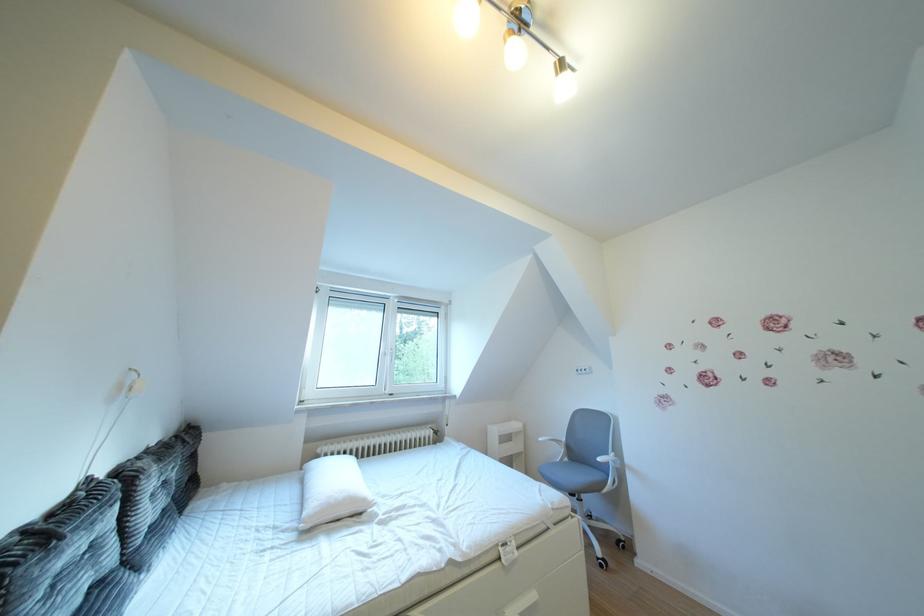
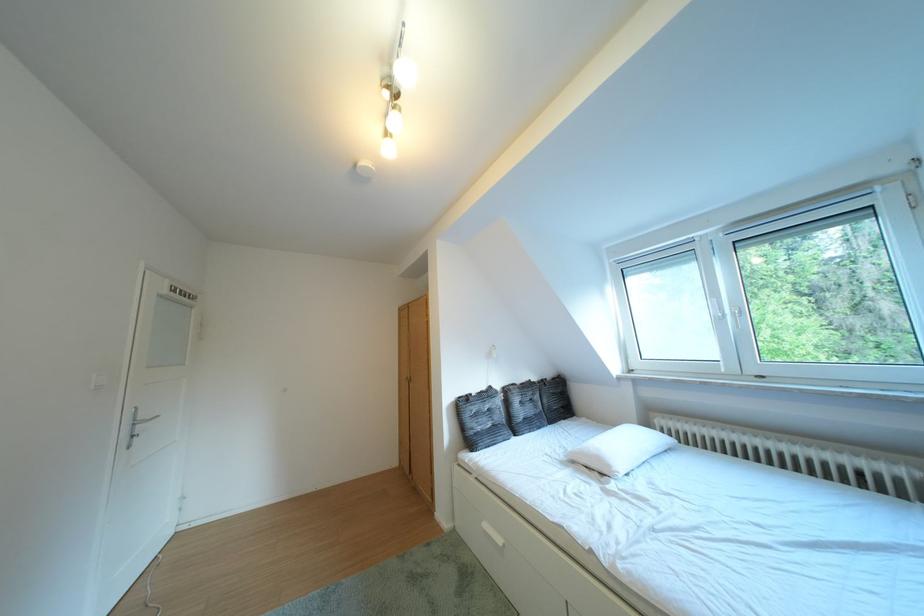
Where in the second image is the point corresponding to (x=378, y=505) from the first image?

(623, 471)